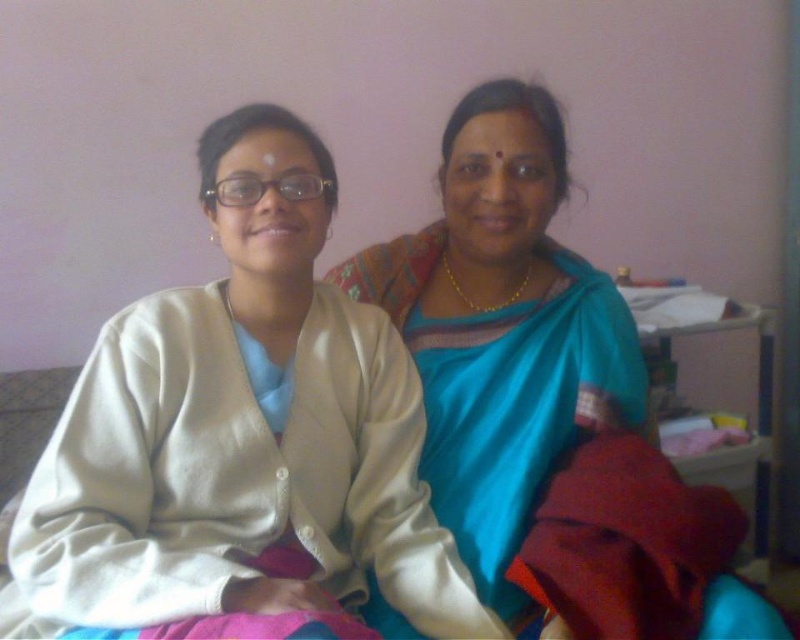
You are a photographer trying to capture both the silky blue saree at center and the silky blue sari at center in a single frame. Which one should you focus on to ensure both are clearly visible?

The silky blue saree at center has a smaller size compared to silky blue sari at center. To ensure both are clearly visible, focus on the larger silky blue sari at center so that the smaller saree can be framed alongside it without being obscured.

You are a fashion designer observing two people sitting against a light pink wall. You notice the silky blue saree at center and the silky blue sari at center. Which one has a wider fabric spread?

The silky blue saree at center might be wider than silky blue sari at center according to the description provided.

You are taking a photo of two people sitting against a light pink wall. You notice two points marked at coordinates point (356, 500) and point (416, 308). Which point is closer to the camera?

Point (356, 500) is closer to the camera than point (416, 308).